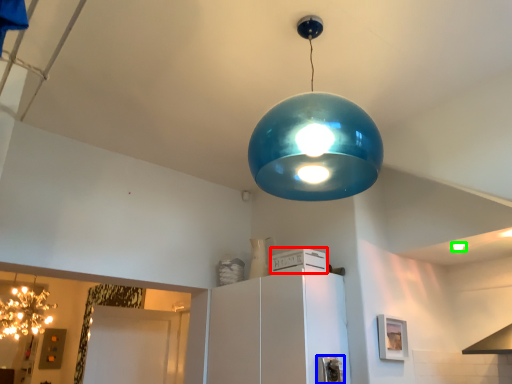
Question: Which object is the closest to the appliance (highlighted by a red box)? Choose among these: appliance (highlighted by a blue box) or light bulb (highlighted by a green box).

Choices:
 (A) appliance
 (B) light bulb

Answer: (A)